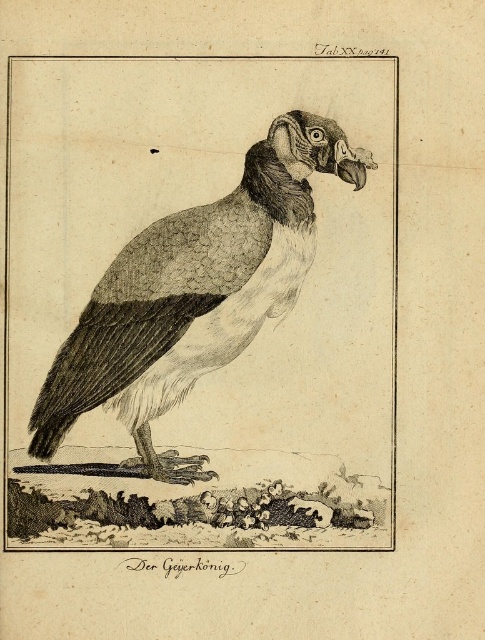
You are an ornithologist examining the illustration of Der Geierkoning. You need to determine the spatial relationship between the gray textured vulture at center and the matte black beak at upper center. Which object is positioned closer to the viewer?

The gray textured vulture at center is closer to the viewer than the matte black beak at upper center.

Based on the scene description, where is the gray textured vulture at center in relation to the matte black beak at upper center?

The gray textured vulture at center is to the left of the matte black beak at upper center.

You are an ornithologist examining the illustration of Der Geierkoning. You notice the gray textured vulture at center and the matte black beak at upper center. Which object is positioned higher in the image?

The matte black beak at upper center is positioned higher in the image than the gray textured vulture at center.